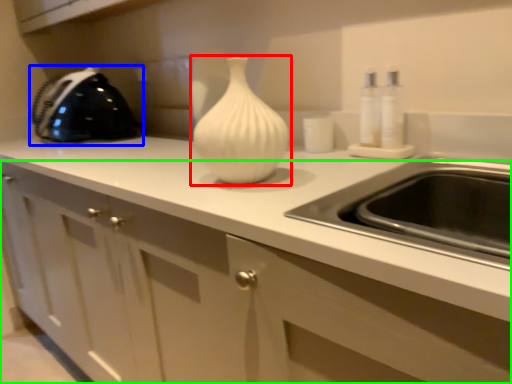
Question: Which object is positioned closest to vase (highlighted by a red box)? Select from appliance (highlighted by a blue box) and cabinetry (highlighted by a green box).

Choices:
 (A) appliance
 (B) cabinetry

Answer: (B)